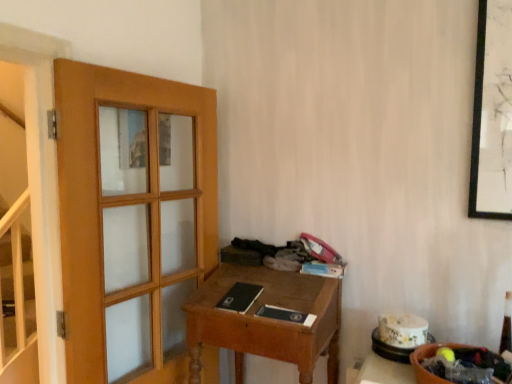
Question: Is matte black book at center, which ranks as the 2th book in right-to-left order, to the left or to the right of wooden desk at center in the image?

Choices:
 (A) right
 (B) left

Answer: (A)

Question: Is matte black book at center, which ranks as the 2th book in right-to-left order, spatially inside wooden desk at center, or outside of it?

Choices:
 (A) inside
 (B) outside

Answer: (A)

Question: Which of these objects is positioned closest to the black matte book at center, which appears as the 1th book when viewed from the left?

Choices:
 (A) white glossy stairwell at left
 (B) matte blue book at center, placed as the first book when sorted from right to left
 (C) matte black book at center, positioned as the 2th book in left-to-right order
 (D) wooden desk at center

Answer: (C)

Question: Which is farther from the black matte book at center, which appears as the 1th book when viewed from the left?

Choices:
 (A) matte black book at center, which ranks as the 2th book in right-to-left order
 (B) matte blue book at center, arranged as the third book when viewed from the left
 (C) wooden desk at center
 (D) white glossy stairwell at left

Answer: (D)